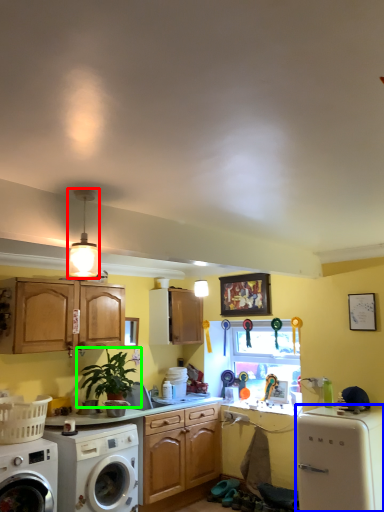
Question: Estimate the real-world distances between objects in this image. Which object is closer to light fixture (highlighted by a red box), dish washer (highlighted by a blue box) or houseplant (highlighted by a green box)?

Choices:
 (A) dish washer
 (B) houseplant

Answer: (B)